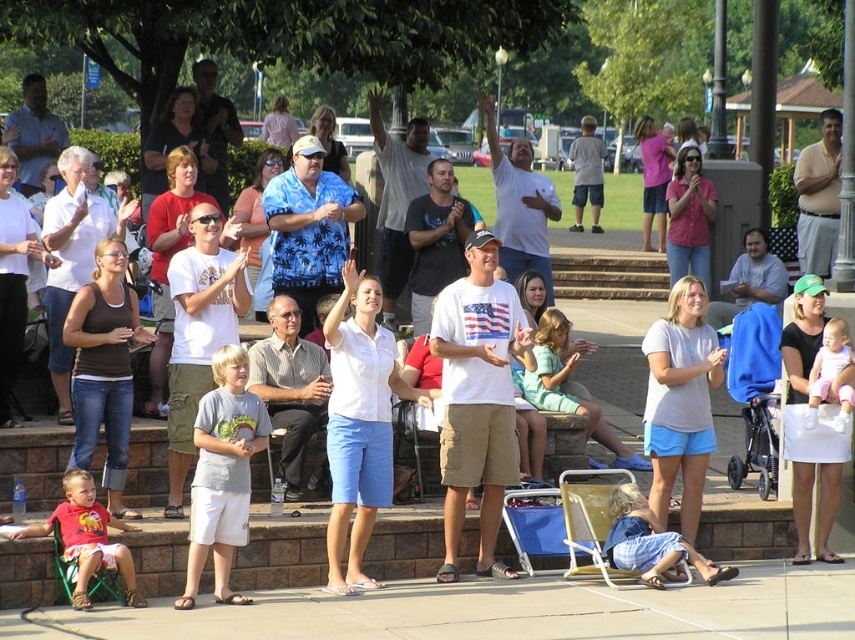
Question: Is gray cotton shirt at center further to the viewer compared to matte red shirt at lower left?

Choices:
 (A) no
 (B) yes

Answer: (B)

Question: Which of the following is the closest to the observer?

Choices:
 (A) pink fabric baby at center
 (B) denim shorts at lower center

Answer: (B)

Question: Is matte red shirt at lower left above pink fabric baby at center?

Choices:
 (A) yes
 (B) no

Answer: (B)

Question: Based on their relative distances, which object is nearer to the denim shorts at lower center?

Choices:
 (A) pink fabric baby at center
 (B) gray cotton shirt at center

Answer: (A)

Question: Does gray cotton shirt at center have a smaller size compared to pink fabric baby at center?

Choices:
 (A) yes
 (B) no

Answer: (B)

Question: Which object appears farthest from the camera in this image?

Choices:
 (A) pink fabric baby at center
 (B) gray cotton shirt at center
 (C) matte red shirt at lower left
 (D) denim shorts at lower center

Answer: (A)